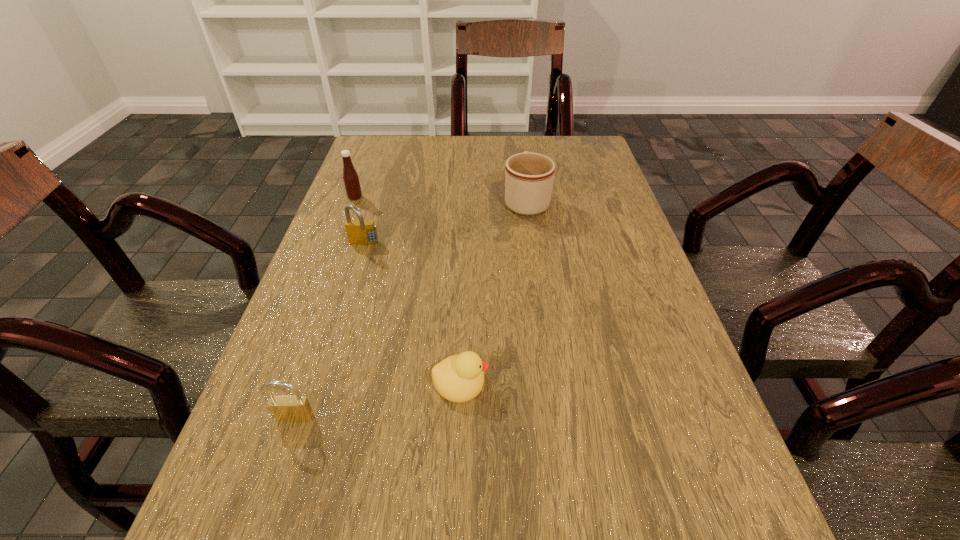
Image resolution: width=960 pixels, height=540 pixels. I want to click on blank space located 0.100m on the side with the combination dials of the farther padlock, so click(352, 281).

Find the location of a particular element. free spot located on the front-facing side of the nearer padlock is located at coordinates (270, 495).

Identify the location of vacant point located 0.200m on the face of the shortest object. (606, 382).

Locate an element on the screen. This screenshot has height=540, width=960. Tabasco sauce at the left edge is located at coordinates (351, 180).

Identify the location of vacant space at the far edge of the desktop. The height and width of the screenshot is (540, 960). (516, 152).

Identify the location of blank space at the left edge. (387, 190).

You are a GUI agent. You are given a task and a screenshot of the screen. Output one action in this format:
    pyautogui.click(x=<x>, y=<y>)
    Task: Click on the free space at the right edge of the desktop
    
    Given the screenshot: What is the action you would take?
    pyautogui.click(x=636, y=373)

This screenshot has height=540, width=960. In the image, there is a desktop. Find the location of `free region at the far left corner`. free region at the far left corner is located at coordinates (413, 139).

Where is `vacant area between the third nearest object and the mug`? vacant area between the third nearest object and the mug is located at coordinates point(445,223).

The width and height of the screenshot is (960, 540). I want to click on free point between the mug and the nearer padlock, so (x=411, y=309).